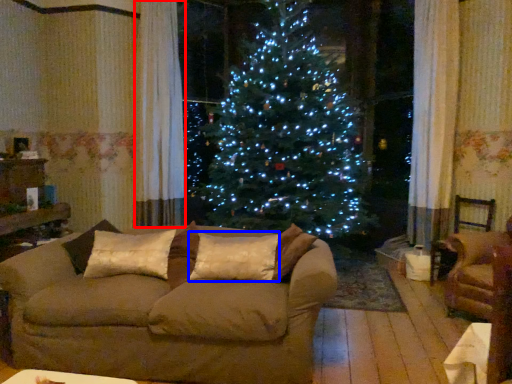
Question: Which point is closer to the camera, curtain (highlighted by a red box) or pillow (highlighted by a blue box)?

Choices:
 (A) curtain
 (B) pillow

Answer: (B)